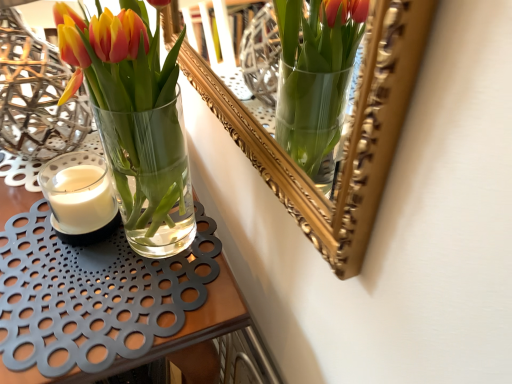
Question: Is clear glass vase at center situated inside white matte candle at left or outside?

Choices:
 (A) outside
 (B) inside

Answer: (A)

Question: From their relative heights in the image, would you say clear glass vase at center is taller or shorter than white matte candle at left?

Choices:
 (A) tall
 (B) short

Answer: (A)

Question: From a real-world perspective, is clear glass vase at center physically located above or below white matte candle at left?

Choices:
 (A) above
 (B) below

Answer: (B)

Question: Based on their sizes in the image, would you say white matte candle at left is bigger or smaller than clear glass vase at center?

Choices:
 (A) big
 (B) small

Answer: (B)

Question: From their relative heights in the image, would you say white matte candle at left is taller or shorter than clear glass vase at center?

Choices:
 (A) short
 (B) tall

Answer: (A)

Question: Relative to clear glass vase at center, is white matte candle at left in front or behind?

Choices:
 (A) front
 (B) behind

Answer: (B)

Question: Would you say white matte candle at left is inside or outside clear glass vase at center?

Choices:
 (A) inside
 (B) outside

Answer: (B)